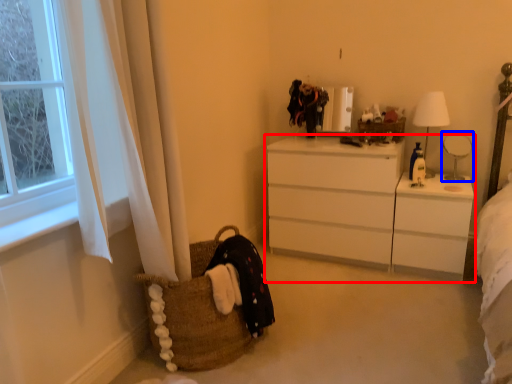
Question: Which object is closer to the camera taking this photo, chest of drawers (highlighted by a red box) or table lamp (highlighted by a blue box)?

Choices:
 (A) chest of drawers
 (B) table lamp

Answer: (A)